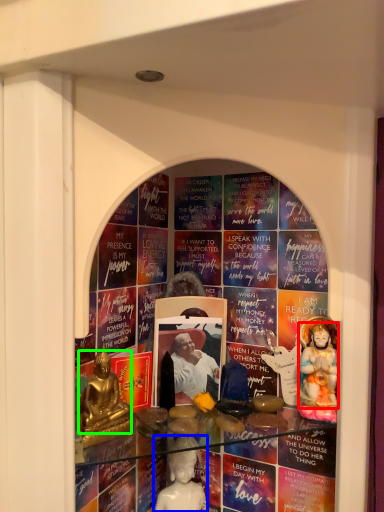
Question: Which is farther away from person (highlighted by a red box)? person (highlighted by a blue box) or person (highlighted by a green box)?

Choices:
 (A) person
 (B) person

Answer: (B)